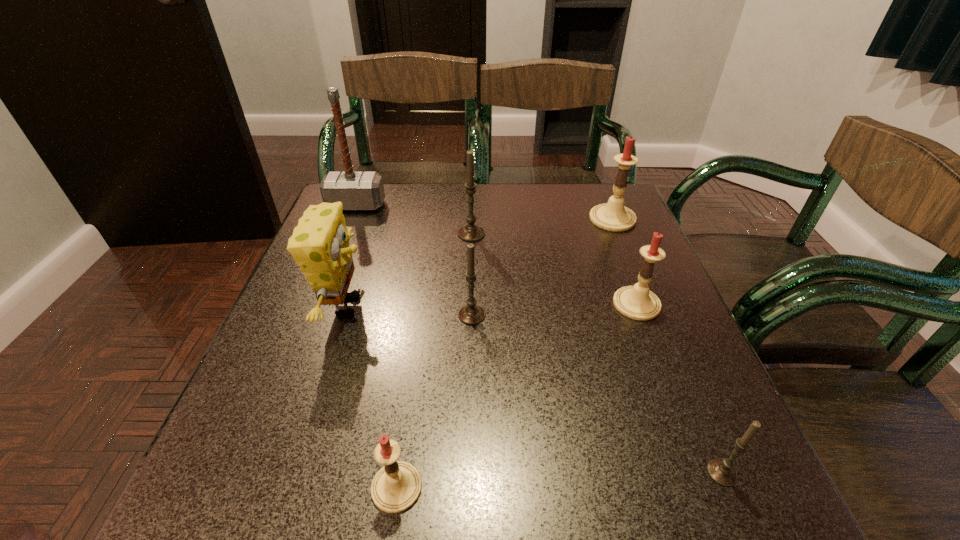
You are a GUI agent. You are given a task and a screenshot of the screen. Output one action in this format:
    pyautogui.click(x=<x>, y=<y>)
    Task: Click on the vacant space that satisfies the following two spatial constraints: 1. on the striking surface of the second farthest gray candle; 2. on the right side of the tallest object
    The image size is (960, 540).
    Given the screenshot: What is the action you would take?
    pyautogui.click(x=313, y=315)

This screenshot has height=540, width=960. I want to click on vacant space that satisfies the following two spatial constraints: 1. on the striking surface of the smallest red candle; 2. on the left side of the brown hammer, so click(x=245, y=488).

This screenshot has width=960, height=540. I want to click on free region that satisfies the following two spatial constraints: 1. on the back side of the smallest red candle; 2. on the face of the yellow sponge, so click(422, 307).